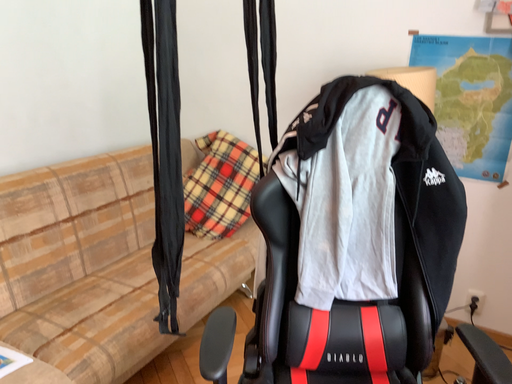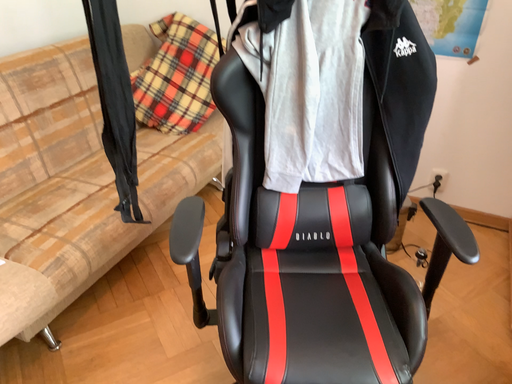
Question: How did the camera likely rotate when shooting the video?

Choices:
 (A) rotated downward
 (B) rotated upward

Answer: (A)